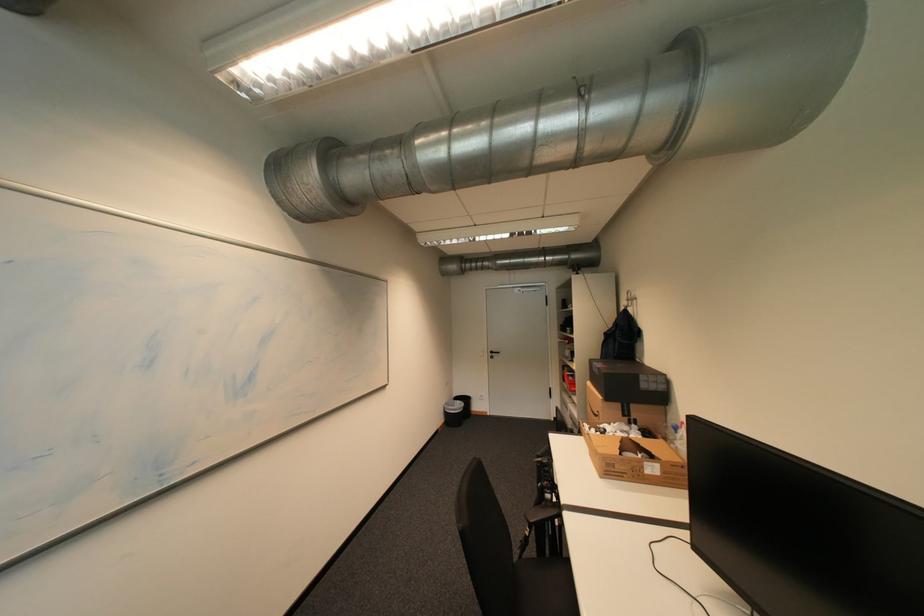
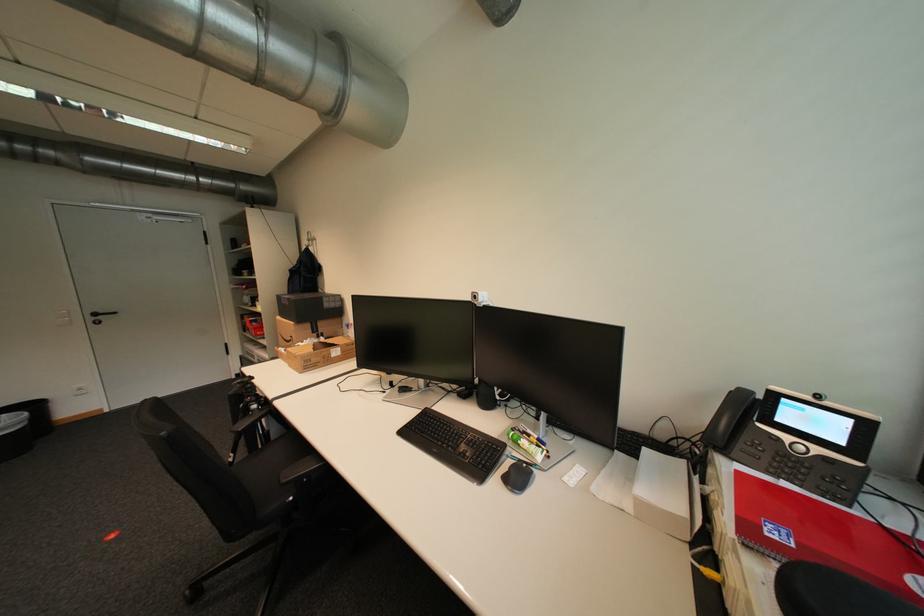
Find the pixel in the second image that matches (555,492) in the first image.

(261, 403)